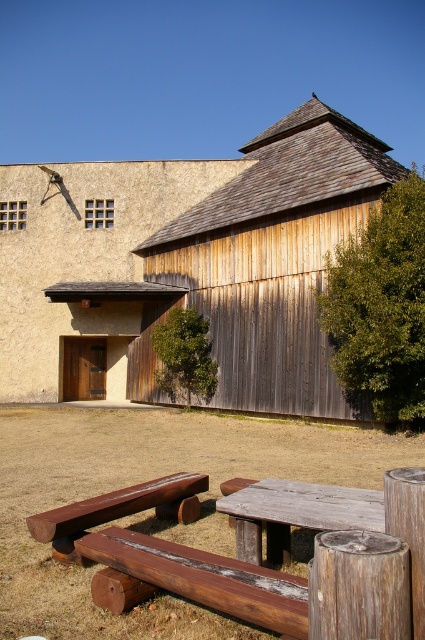
Question: Where is wooden picnic table at center located in relation to rustic wood bench at lower center in the image?

Choices:
 (A) left
 (B) right

Answer: (B)

Question: Does wooden barn at center appear on the left side of rustic wood bench at lower center?

Choices:
 (A) yes
 (B) no

Answer: (B)

Question: Which of the following is the farthest from the observer?

Choices:
 (A) (325, 513)
 (B) (246, 563)
 (C) (107, 310)
 (D) (64, 547)

Answer: (C)

Question: Does weathered wood bench at lower center have a larger size compared to rustic wood bench at lower center?

Choices:
 (A) no
 (B) yes

Answer: (A)

Question: Which point is farther to the camera?

Choices:
 (A) (234, 600)
 (B) (37, 538)

Answer: (B)

Question: Among these objects, which one is farthest from the camera?

Choices:
 (A) wooden picnic table at center
 (B) wooden barn at center

Answer: (B)